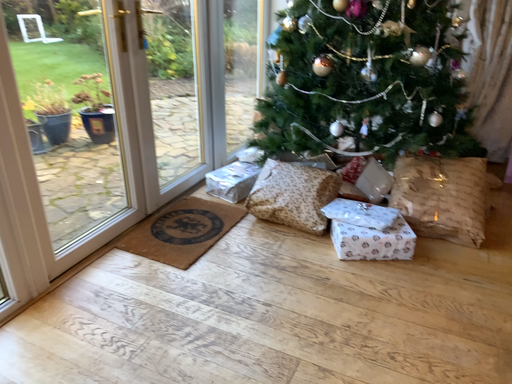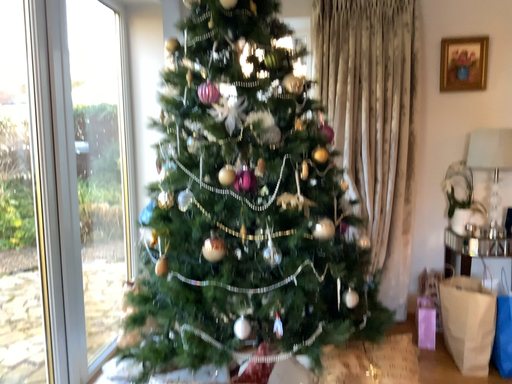
Question: How did the camera likely rotate when shooting the video?

Choices:
 (A) rotated upward
 (B) rotated downward

Answer: (A)